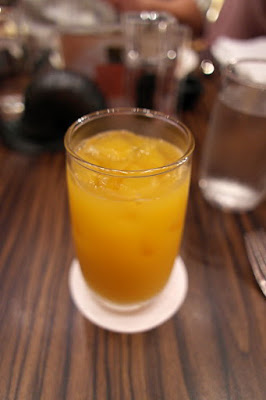
This screenshot has height=400, width=266. I want to click on wooden table, so click(x=228, y=271).